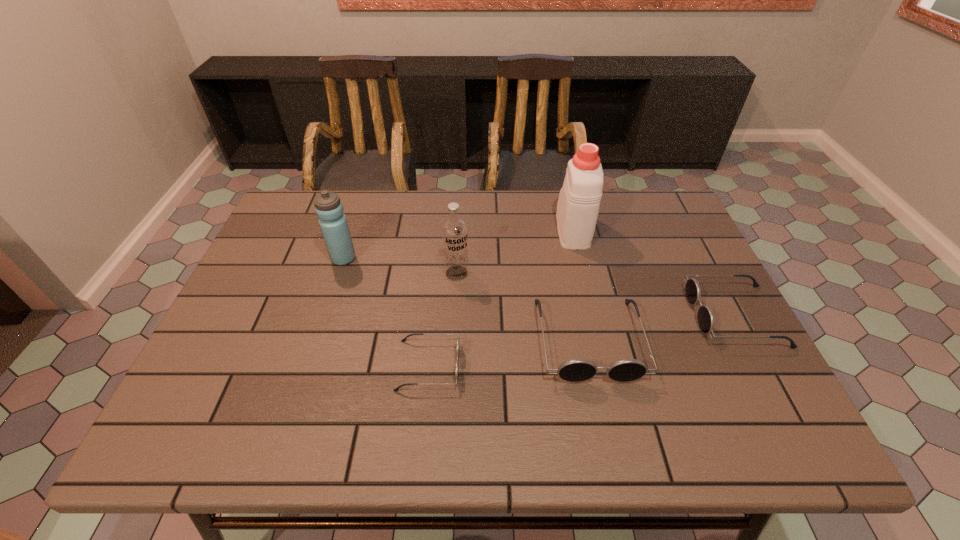
The image size is (960, 540). What are the coordinates of `empty space between the leftmost sunglasses and the second sunglasses from right to left` in the screenshot? It's located at (509, 352).

What are the coordinates of `empty space that is in between the rightmost object and the water bottle` in the screenshot? It's located at (539, 287).

Locate which object ranks fifth in proximity to the leftmost object. Please provide its 2D coordinates. Your answer should be formatted as a tuple, i.e. [(x, y)], where the tuple contains the x and y coordinates of a point satisfying the conditions above.

[(706, 321)]

Where is `object that is the fifth closest to the second sunglasses from right to left`? The height and width of the screenshot is (540, 960). object that is the fifth closest to the second sunglasses from right to left is located at coordinates (333, 223).

You are a GUI agent. You are given a task and a screenshot of the screen. Output one action in this format:
    pyautogui.click(x=<x>, y=<y>)
    Task: Click on the sunglasses that stands as the second closest to the vodka
    Image resolution: width=960 pixels, height=540 pixels.
    Given the screenshot: What is the action you would take?
    pyautogui.click(x=458, y=339)

Select which sunglasses appears as the closest to the tallest object. Please provide its 2D coordinates. Your answer should be formatted as a tuple, i.e. [(x, y)], where the tuple contains the x and y coordinates of a point satisfying the conditions above.

[(576, 370)]

Image resolution: width=960 pixels, height=540 pixels. I want to click on free spot that satisfies the following two spatial constraints: 1. on the front-facing side of the rightmost object; 2. on the front-facing side of the second sunglasses from right to left, so click(747, 339).

The image size is (960, 540). What are the coordinates of `free location that satisfies the following two spatial constraints: 1. on the front-facing side of the second sunglasses from left to right; 2. on the front-facing side of the shortest object` in the screenshot? It's located at (594, 365).